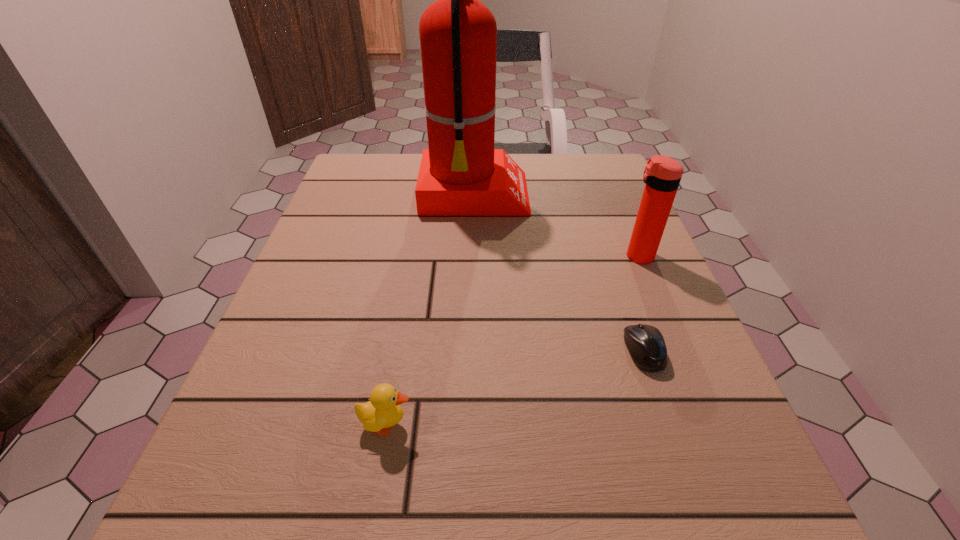
Where is `vacant space at the near left corner`? The height and width of the screenshot is (540, 960). vacant space at the near left corner is located at coordinates pyautogui.click(x=278, y=487).

In the image, there is a desktop. Identify the location of free space at the far right corner. (576, 157).

You are a GUI agent. You are given a task and a screenshot of the screen. Output one action in this format:
    pyautogui.click(x=<x>, y=<y>)
    Task: Click on the vacant space at the near right corner of the desktop
    This screenshot has width=960, height=540.
    Given the screenshot: What is the action you would take?
    pyautogui.click(x=705, y=485)

The height and width of the screenshot is (540, 960). Find the location of `blank region between the second tallest object and the tallest object`. blank region between the second tallest object and the tallest object is located at coordinates (557, 226).

Identify the location of free space between the second tallest object and the nearest object. Image resolution: width=960 pixels, height=540 pixels. (513, 340).

Locate an element on the screen. vacant space in between the third nearest object and the fire extinguisher is located at coordinates (557, 226).

Locate an element on the screen. The image size is (960, 540). empty space between the fire extinguisher and the mouse is located at coordinates (560, 273).

Locate an element on the screen. The width and height of the screenshot is (960, 540). free spot between the shortest object and the fire extinguisher is located at coordinates (560, 273).

I want to click on blank region between the third farthest object and the fire extinguisher, so point(560,273).

Locate an element on the screen. The height and width of the screenshot is (540, 960). free space between the second shortest object and the third farthest object is located at coordinates (516, 388).